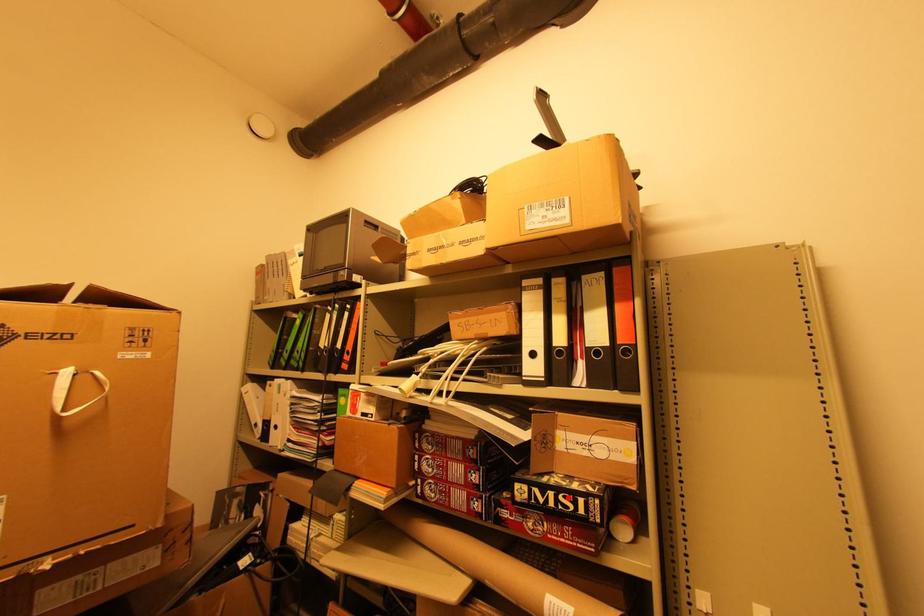
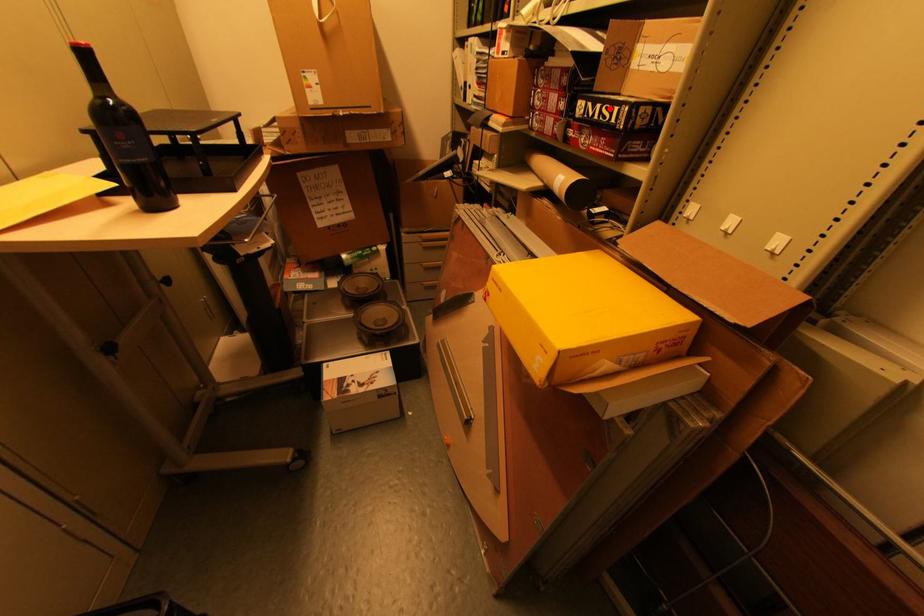
I am providing you with two images of the same scene from different viewpoints. A red point is marked on the first image and another point is marked on the second image. Does the point marked in image1 correspond to the same location as the one in image2?

Yes